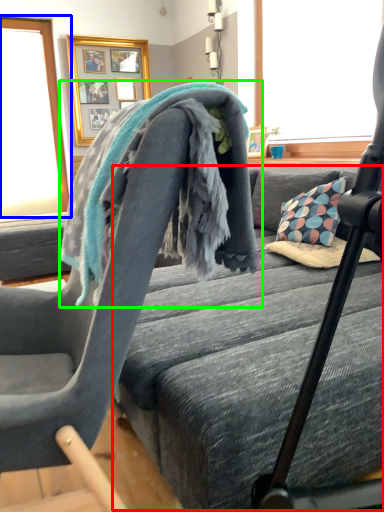
Question: Estimate the real-world distances between objects in this image. Which object is closer to bed frame (highlighted by a red box), window screen (highlighted by a blue box) or bath towel (highlighted by a green box)?

Choices:
 (A) window screen
 (B) bath towel

Answer: (B)